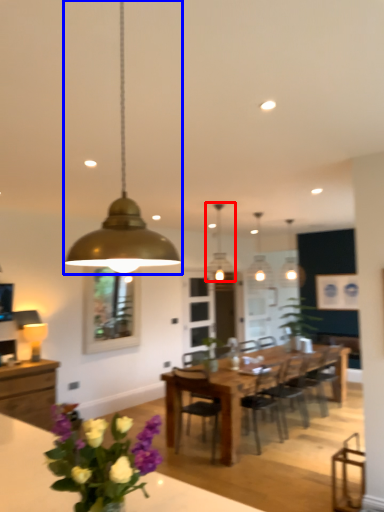
Question: Which object appears closest to the camera in this image, lamp (highlighted by a red box) or lamp (highlighted by a blue box)?

Choices:
 (A) lamp
 (B) lamp

Answer: (B)